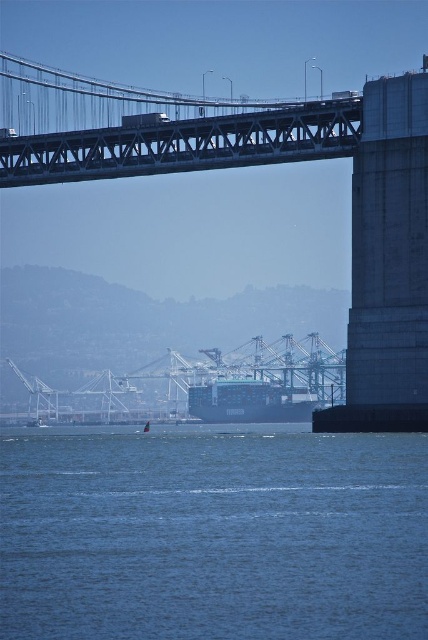
Which of these two, metallic gray bridge at center or blue matte cargo ship at center, stands shorter?

Standing shorter between the two is blue matte cargo ship at center.

Is metallic gray bridge at center below blue matte cargo ship at center?

Incorrect, metallic gray bridge at center is not positioned below blue matte cargo ship at center.

The image size is (428, 640). What do you see at coordinates (201, 387) in the screenshot?
I see `metallic gray bridge at center` at bounding box center [201, 387].

This screenshot has width=428, height=640. What are the coordinates of `metallic gray bridge at center` in the screenshot? It's located at (201, 387).

Can you confirm if blue water at lower center is smaller than blue matte cargo ship at center?

No, blue water at lower center is not smaller than blue matte cargo ship at center.

Can you confirm if blue water at lower center is bigger than blue matte cargo ship at center?

Correct, blue water at lower center is larger in size than blue matte cargo ship at center.

Identify the location of blue water at lower center. This screenshot has width=428, height=640. (213, 536).

Which is in front, point (168, 518) or point (104, 419)?

Point (168, 518) is in front.

How much distance is there between blue water at lower center and metallic gray bridge at center?

They are 447.93 feet apart.

Looking at this image, who is more distant from viewer, [104,458] or [342,400]?

The point [342,400] is more distant.

Find the location of a particular element. blue water at lower center is located at coordinates (213, 536).